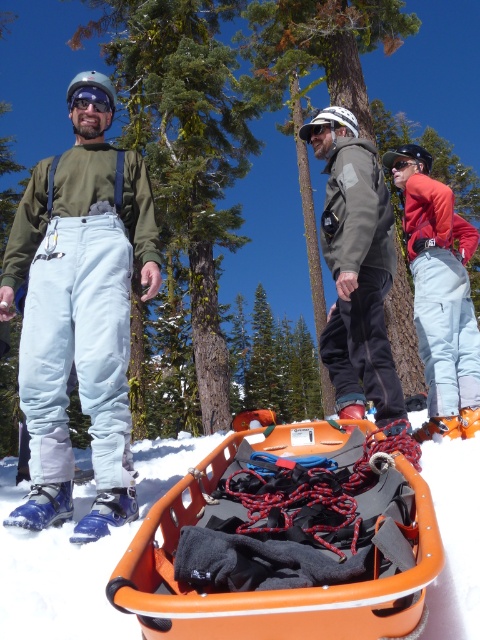
Question: Does matte orange ski boot at right have a lesser width compared to blue plastic snowshoe at lower left?

Choices:
 (A) yes
 (B) no

Answer: (B)

Question: Which of the following is the closest to the observer?

Choices:
 (A) blue plastic snowshoe at lower left
 (B) blue rubber snowshoe at lower left
 (C) matte gray jacket at center

Answer: (A)

Question: Is matte gray jacket at center to the right of blue plastic snowshoe at lower left from the viewer's perspective?

Choices:
 (A) yes
 (B) no

Answer: (A)

Question: Is matte blue ski pants at left bigger than blue rubber snowshoe at lower left?

Choices:
 (A) yes
 (B) no

Answer: (A)

Question: Which object appears closest to the camera in this image?

Choices:
 (A) blue rubber snowshoe at lower left
 (B) matte gray jacket at center

Answer: (A)

Question: Estimate the real-world distances between objects in this image. Which object is farther from the matte blue ski pants at left?

Choices:
 (A) matte orange ski boot at right
 (B) blue plastic snowshoe at lower left
 (C) matte gray jacket at center

Answer: (A)